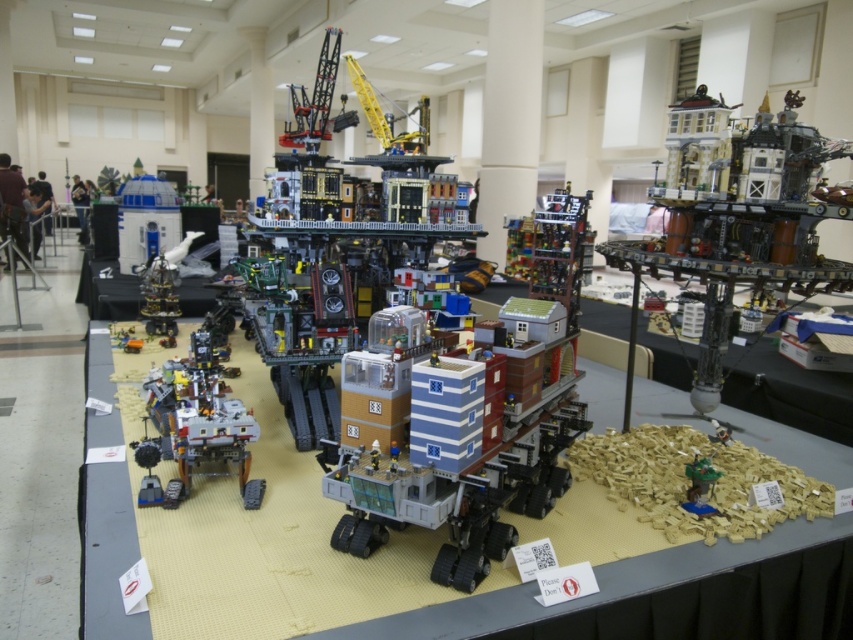
Question: Which point is closer to the camera?

Choices:
 (A) matte plastic rover at center
 (B) matte silver rover at center
 (C) clear plastic tower at center-left
 (D) brickwork tower at upper right

Answer: (A)

Question: In this image, where is matte plastic rover at center located relative to matte silver rover at center?

Choices:
 (A) right
 (B) left

Answer: (A)

Question: Which point appears closest to the camera in this image?

Choices:
 (A) (148, 284)
 (B) (701, 412)

Answer: (B)

Question: Which of the following is the closest to the observer?

Choices:
 (A) matte silver rover at center
 (B) brickwork tower at upper right
 (C) clear plastic tower at center-left
 (D) matte plastic rover at center

Answer: (D)

Question: Can you confirm if brickwork tower at upper right is wider than clear plastic tower at center-left?

Choices:
 (A) no
 (B) yes

Answer: (B)

Question: Does brickwork tower at upper right appear on the right side of clear plastic tower at center-left?

Choices:
 (A) yes
 (B) no

Answer: (A)